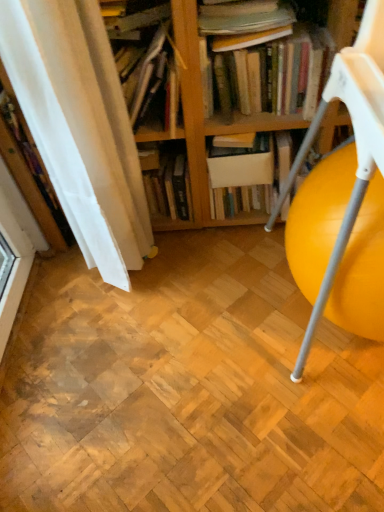
The image size is (384, 512). I want to click on hardcover book at center, which appears as the second book when viewed from the right, so click(167, 180).

What is the approximate width of hardcover books at upper center, the first book viewed from the right?

hardcover books at upper center, the first book viewed from the right, is 12.73 inches wide.

Where is `white fabric curtain at left`? The image size is (384, 512). white fabric curtain at left is located at coordinates (80, 127).

The width and height of the screenshot is (384, 512). Identify the location of yellow plastic ball at right. (355, 141).

Between point (262, 161) and point (157, 42), which one is positioned in front?

The point (157, 42) is in front.

From a real-world perspective, who is located higher, white matte book at center or wooden bookshelf at upper center, placed as the first book when sorted from left to right?

From a 3D spatial view, wooden bookshelf at upper center, placed as the first book when sorted from left to right, is above.

From the image's perspective, would you say white matte book at center is positioned over wooden bookshelf at upper center, placed as the first book when sorted from left to right?

No, from the image's perspective, white matte book at center is not over wooden bookshelf at upper center, placed as the first book when sorted from left to right.

From their relative heights in the image, would you say white matte book at center is taller or shorter than wooden bookshelf at upper center, placed as the first book when sorted from left to right?

white matte book at center is shorter than wooden bookshelf at upper center, placed as the first book when sorted from left to right.

From the picture: Is hardcover books at upper center, the first book viewed from the right, shorter than hardcover book at center, which appears as the second book when viewed from the right?

Indeed, hardcover books at upper center, the first book viewed from the right, has a lesser height compared to hardcover book at center, which appears as the second book when viewed from the right.

Measure the distance between hardcover books at upper center, which appears as the 3th book when viewed from the left, and hardcover book at center, the 2th book when ordered from left to right.

hardcover books at upper center, which appears as the 3th book when viewed from the left, is 34.52 centimeters from hardcover book at center, the 2th book when ordered from left to right.

Which of these two, hardcover books at upper center, which appears as the 3th book when viewed from the left, or hardcover book at center, the 2th book when ordered from left to right, is bigger?

hardcover books at upper center, which appears as the 3th book when viewed from the left, is bigger.

What's the angular difference between hardcover books at upper center, the first book viewed from the right, and hardcover book at center, which appears as the second book when viewed from the right,'s facing directions?

hardcover books at upper center, the first book viewed from the right, and hardcover book at center, which appears as the second book when viewed from the right, are facing 0.00106 degrees away from each other.

Is hardcover books at upper center, which appears as the 3th book when viewed from the left, turned away from white matte book at center?

hardcover books at upper center, which appears as the 3th book when viewed from the left, is not turned away from white matte book at center.

Does point (307, 118) come closer to viewer compared to point (241, 178)?

Yes, point (307, 118) is closer to viewer.

From a real-world perspective, who is located higher, hardcover books at upper center, which appears as the 3th book when viewed from the left, or white matte book at center?

hardcover books at upper center, which appears as the 3th book when viewed from the left.

How much distance is there between hardcover books at upper center, the first book viewed from the right, and white matte book at center?

A distance of 7.83 inches exists between hardcover books at upper center, the first book viewed from the right, and white matte book at center.

Considering the relative sizes of yellow plastic ball at right and hardcover books at upper center, which appears as the 3th book when viewed from the left, in the image provided, is yellow plastic ball at right smaller than hardcover books at upper center, which appears as the 3th book when viewed from the left,?

No.

Is yellow plastic ball at right inside or outside of hardcover books at upper center, which appears as the 3th book when viewed from the left?

yellow plastic ball at right is outside hardcover books at upper center, which appears as the 3th book when viewed from the left.

Is point (337, 82) closer or farther from the camera than point (247, 113)?

Point (337, 82) is positioned closer to the camera compared to point (247, 113).

Considering the relative sizes of yellow plastic ball at right and hardcover books at upper center, the first book viewed from the right, in the image provided, is yellow plastic ball at right thinner than hardcover books at upper center, the first book viewed from the right,?

Incorrect, the width of yellow plastic ball at right is not less than that of hardcover books at upper center, the first book viewed from the right.

Considering the sizes of yellow plastic ball at right and white fabric curtain at left in the image, is yellow plastic ball at right wider or thinner than white fabric curtain at left?

yellow plastic ball at right is wider than white fabric curtain at left.

Is white fabric curtain at left at the back of yellow plastic ball at right?

No, yellow plastic ball at right is not facing away from white fabric curtain at left.

Image resolution: width=384 pixels, height=512 pixels. Find the location of `rocking chair in front of the white fabric curtain at left`. rocking chair in front of the white fabric curtain at left is located at coordinates (355, 141).

Is yellow plastic ball at right far from white fabric curtain at left?

No, yellow plastic ball at right is not far from white fabric curtain at left.

Are white matte book at center and yellow plastic ball at right located far from each other?

No, white matte book at center is not far from yellow plastic ball at right.

How many degrees apart are the facing directions of white matte book at center and yellow plastic ball at right?

2.68 degrees separate the facing orientations of white matte book at center and yellow plastic ball at right.

Based on the photo, is white matte book at center facing away from yellow plastic ball at right?

white matte book at center is not turned away from yellow plastic ball at right.

From the image's perspective, between hardcover book at center, the 2th book when ordered from left to right, and white matte book at center, who is located below?

hardcover book at center, the 2th book when ordered from left to right, appears lower in the image.

Between hardcover book at center, which appears as the second book when viewed from the right, and white matte book at center, which one appears on the left side from the viewer's perspective?

hardcover book at center, which appears as the second book when viewed from the right.

Considering the sizes of hardcover book at center, the 2th book when ordered from left to right, and white matte book at center in the image, is hardcover book at center, the 2th book when ordered from left to right, taller or shorter than white matte book at center?

Clearly, hardcover book at center, the 2th book when ordered from left to right, is taller compared to white matte book at center.

Is the position of hardcover book at center, the 2th book when ordered from left to right, more distant than that of white matte book at center?

Yes, it is behind white matte book at center.

You are a GUI agent. You are given a task and a screenshot of the screen. Output one action in this format:
    pyautogui.click(x=<x>, y=<y>)
    Task: Click on the book that is the 2nd object to the left of the white matte book at center, starting at the anchor
    
    Given the screenshot: What is the action you would take?
    pyautogui.click(x=145, y=54)

Find the location of `book on the right of hardcover book at center, the 2th book when ordered from left to right`. book on the right of hardcover book at center, the 2th book when ordered from left to right is located at coordinates click(x=276, y=74).

When comparing their distances from white matte book at center, does hardcover books at upper center, the first book viewed from the right, or hardcover book at center, the 2th book when ordered from left to right, seem further?

hardcover books at upper center, the first book viewed from the right, lies further to white matte book at center than the other object.

From the image, which object appears to be farther from yellow plastic ball at right, wooden bookshelf at upper center, placed as the first book when sorted from left to right, or hardcover book at center, the 2th book when ordered from left to right?

Based on the image, wooden bookshelf at upper center, placed as the first book when sorted from left to right, appears to be further to yellow plastic ball at right.

Considering their positions, is hardcover books at upper center, which appears as the 3th book when viewed from the left, positioned closer to wooden bookshelf at upper center, positioned as the third book in right-to-left order, than white fabric curtain at left?

white fabric curtain at left is positioned closer to the anchor wooden bookshelf at upper center, positioned as the third book in right-to-left order.

From the image, which object appears to be farther from hardcover books at upper center, which appears as the 3th book when viewed from the left, white matte book at center or yellow plastic ball at right?

Based on the image, yellow plastic ball at right appears to be further to hardcover books at upper center, which appears as the 3th book when viewed from the left.

Looking at the image, which one is located closer to yellow plastic ball at right, white matte book at center or hardcover books at upper center, the first book viewed from the right?

hardcover books at upper center, the first book viewed from the right, is closer to yellow plastic ball at right.

From the image, which object appears to be farther from hardcover book at center, the 2th book when ordered from left to right, yellow plastic ball at right or white matte book at center?

yellow plastic ball at right.

Based on their spatial positions, is hardcover book at center, the 2th book when ordered from left to right, or white fabric curtain at left closer to hardcover books at upper center, which appears as the 3th book when viewed from the left?

The object closer to hardcover books at upper center, which appears as the 3th book when viewed from the left, is hardcover book at center, the 2th book when ordered from left to right.

Based on their spatial positions, is hardcover books at upper center, which appears as the 3th book when viewed from the left, or yellow plastic ball at right further from hardcover book at center, the 2th book when ordered from left to right?

Based on the image, yellow plastic ball at right appears to be further to hardcover book at center, the 2th book when ordered from left to right.

Where is `book between yellow plastic ball at right and hardcover books at upper center, the first book viewed from the right, in the front-back direction`? This screenshot has height=512, width=384. book between yellow plastic ball at right and hardcover books at upper center, the first book viewed from the right, in the front-back direction is located at coordinates (145, 54).

Locate an element on the screen. The height and width of the screenshot is (512, 384). paperback book between yellow plastic ball at right and hardcover book at center, which appears as the second book when viewed from the right, in the front-back direction is located at coordinates (242, 169).

At what (x,y) coordinates should I click in order to perform the action: click on paperback book between hardcover book at center, which appears as the second book when viewed from the right, and hardcover books at upper center, which appears as the 3th book when viewed from the left, from left to right. Please return your answer as a coordinate pair (x, y). The image size is (384, 512). Looking at the image, I should click on (242, 169).

Where is `paperback book between wooden bookshelf at upper center, placed as the first book when sorted from left to right, and hardcover books at upper center, the first book viewed from the right`? Image resolution: width=384 pixels, height=512 pixels. paperback book between wooden bookshelf at upper center, placed as the first book when sorted from left to right, and hardcover books at upper center, the first book viewed from the right is located at coordinates (242, 169).